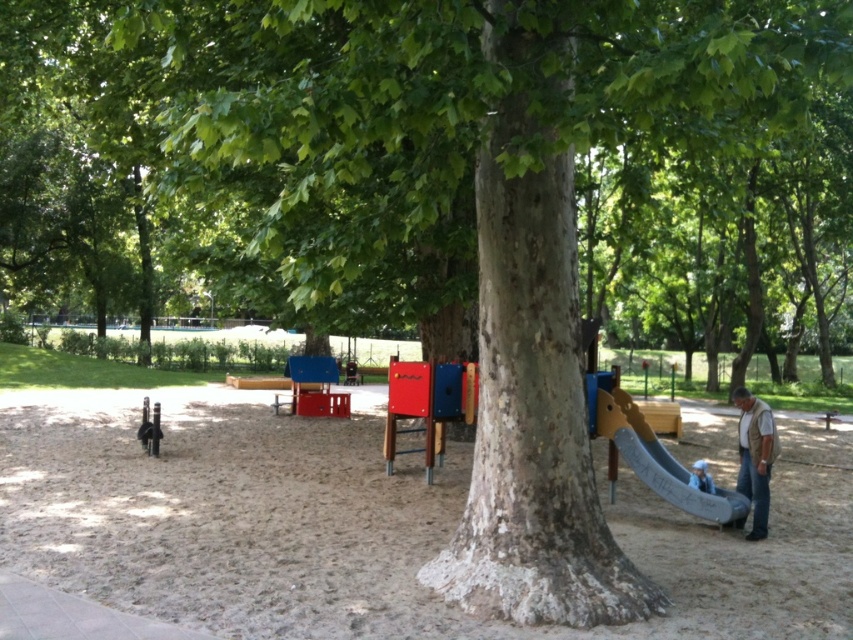
Question: Which object is closer to the camera taking this photo?

Choices:
 (A) blue fabric at lower right
 (B) brown leather vest at lower right
 (C) smooth gray slide at right
 (D) brown sandy playground at center

Answer: (D)

Question: Which object appears closest to the camera in this image?

Choices:
 (A) brown sandy playground at center
 (B) brown leather vest at lower right
 (C) blue fabric at lower right
 (D) smooth gray slide at right

Answer: (A)

Question: Does brown leather vest at lower right have a lesser width compared to blue fabric at lower right?

Choices:
 (A) no
 (B) yes

Answer: (A)

Question: Which point appears closest to the camera in this image?

Choices:
 (A) (280, 465)
 (B) (654, 470)
 (C) (756, 515)
 (D) (695, 468)

Answer: (C)

Question: Does smooth gray slide at right appear on the left side of brown leather vest at lower right?

Choices:
 (A) no
 (B) yes

Answer: (B)

Question: Does smooth gray slide at right appear under blue fabric at lower right?

Choices:
 (A) yes
 (B) no

Answer: (B)